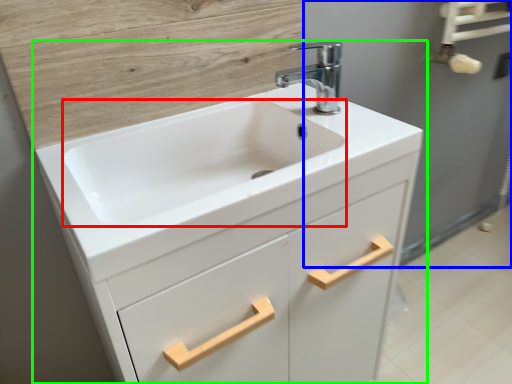
Question: Which is farther away from sink (highlighted by a red box)? screen door (highlighted by a blue box) or bathroom cabinet (highlighted by a green box)?

Choices:
 (A) screen door
 (B) bathroom cabinet

Answer: (A)